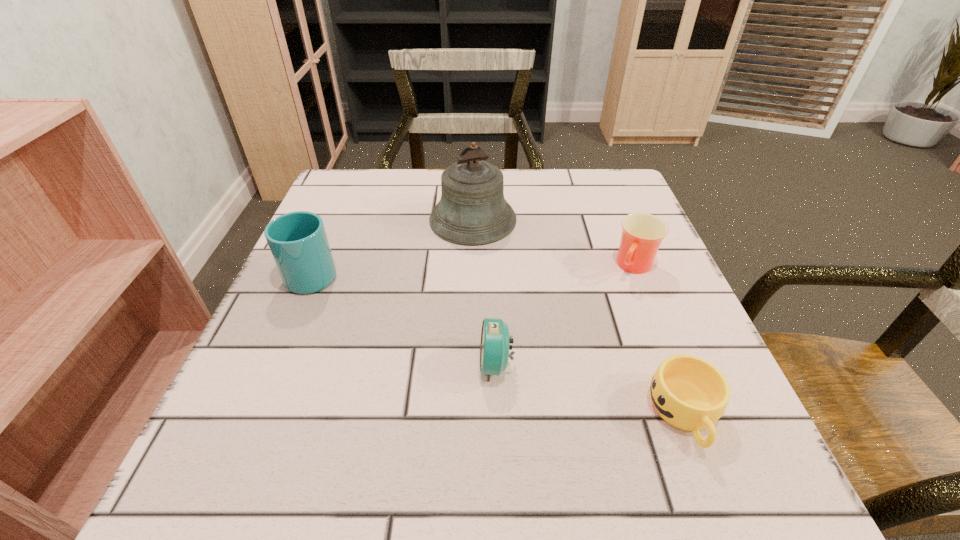
Find the location of a particular element. blank space that satisfies the following two spatial constraints: 1. on the handle side of the leftmost object; 2. on the left side of the bell is located at coordinates (336, 220).

You are a GUI agent. You are given a task and a screenshot of the screen. Output one action in this format:
    pyautogui.click(x=<x>, y=<y>)
    Task: Click on the free space in the image that satisfies the following two spatial constraints: 1. on the front side of the shortest cup; 2. on the left side of the bell
    This screenshot has width=960, height=540.
    Given the screenshot: What is the action you would take?
    pyautogui.click(x=468, y=414)